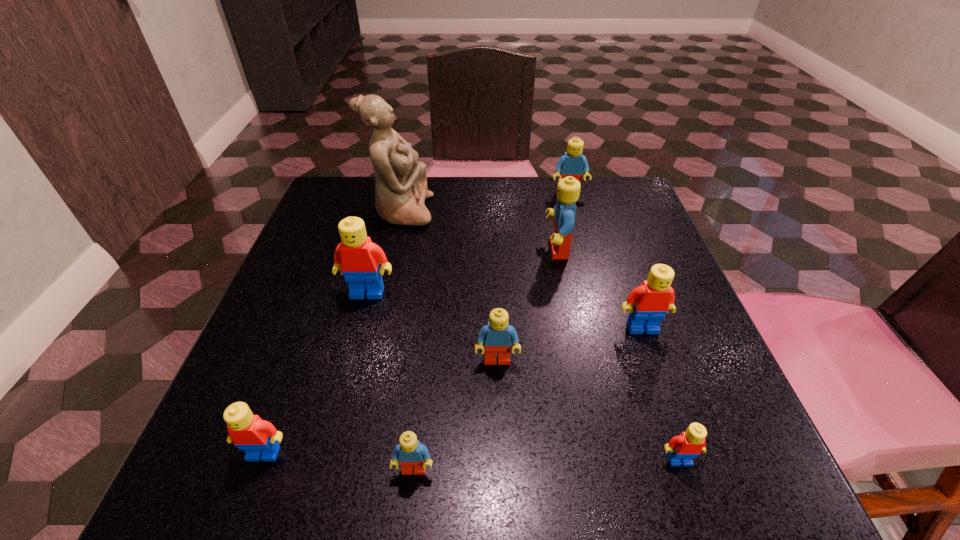
At what (x,y) coordinates should I click in order to perform the action: click on the tallest object. Please return your answer as a coordinate pair (x, y). This screenshot has height=540, width=960. Looking at the image, I should click on (401, 188).

Find the location of `figurine`. figurine is located at coordinates (401, 188).

You are a GUI agent. You are given a task and a screenshot of the screen. Output one action in this format:
    pyautogui.click(x=<x>, y=<y>)
    Task: Click on the seventh nearest Lego
    This screenshot has width=960, height=540.
    Given the screenshot: What is the action you would take?
    pyautogui.click(x=568, y=189)

The height and width of the screenshot is (540, 960). I want to click on the second farthest blue Lego, so click(568, 189).

Locate an element on the screen. The width and height of the screenshot is (960, 540). the farthest red Lego is located at coordinates 357,257.

Find the location of a particular element. the fourth farthest object is located at coordinates (357, 257).

The width and height of the screenshot is (960, 540). I want to click on the farthest blue Lego, so click(572, 163).

The height and width of the screenshot is (540, 960). Identify the location of the third smallest blue Lego. (572, 163).

This screenshot has height=540, width=960. Identify the location of the third nearest red Lego. (648, 304).

Where is `the fifth nearest Lego`? the fifth nearest Lego is located at coordinates (648, 304).